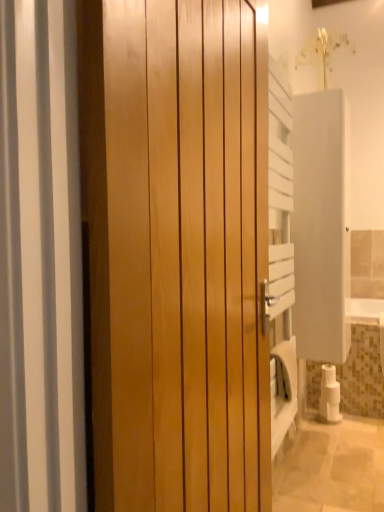
Question: Are white matte toilet paper at lower right and white matte screen door at right making contact?

Choices:
 (A) yes
 (B) no

Answer: (B)

Question: Are white matte toilet paper at lower right and white matte screen door at right far apart?

Choices:
 (A) yes
 (B) no

Answer: (B)

Question: Can you confirm if white matte toilet paper at lower right is wider than white matte screen door at right?

Choices:
 (A) yes
 (B) no

Answer: (B)

Question: From the image's perspective, is white matte toilet paper at lower right located above white matte screen door at right?

Choices:
 (A) no
 (B) yes

Answer: (A)

Question: Is white matte toilet paper at lower right at the right side of white matte screen door at right?

Choices:
 (A) no
 (B) yes

Answer: (B)

Question: Considering their positions, is white matte screen door at right located in front of or behind glossy wood door at center?

Choices:
 (A) behind
 (B) front

Answer: (A)

Question: Looking at the image, does white matte screen door at right seem bigger or smaller compared to glossy wood door at center?

Choices:
 (A) big
 (B) small

Answer: (B)

Question: Is white matte screen door at right taller or shorter than glossy wood door at center?

Choices:
 (A) short
 (B) tall

Answer: (A)

Question: Is point (349, 338) positioned closer to the camera than point (210, 398)?

Choices:
 (A) closer
 (B) farther

Answer: (B)

Question: Is white matte screen door at right in front of or behind white matte toilet paper at lower right in the image?

Choices:
 (A) front
 (B) behind

Answer: (A)

Question: Is white matte screen door at right to the left or to the right of white matte toilet paper at lower right in the image?

Choices:
 (A) right
 (B) left

Answer: (B)

Question: Is white matte screen door at right bigger or smaller than white matte toilet paper at lower right?

Choices:
 (A) small
 (B) big

Answer: (B)

Question: Choose the correct answer: Is white matte screen door at right inside white matte toilet paper at lower right or outside it?

Choices:
 (A) inside
 (B) outside

Answer: (B)

Question: From a real-world perspective, is glossy wood door at center above or below white matte toilet paper at lower right?

Choices:
 (A) below
 (B) above

Answer: (B)

Question: In the image, is glossy wood door at center on the left side or the right side of white matte toilet paper at lower right?

Choices:
 (A) left
 (B) right

Answer: (A)